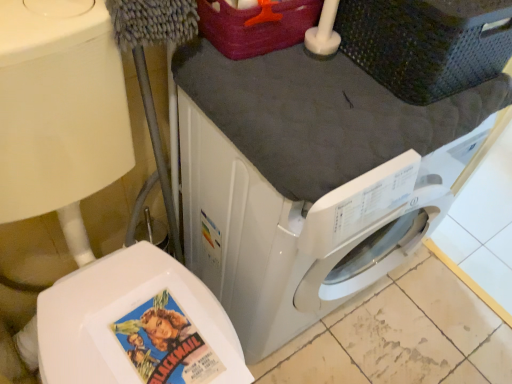
Locate an element on the screen. vacant space situated above matte paper comic book at lower left (from a real-world perspective) is located at coordinates (161, 344).